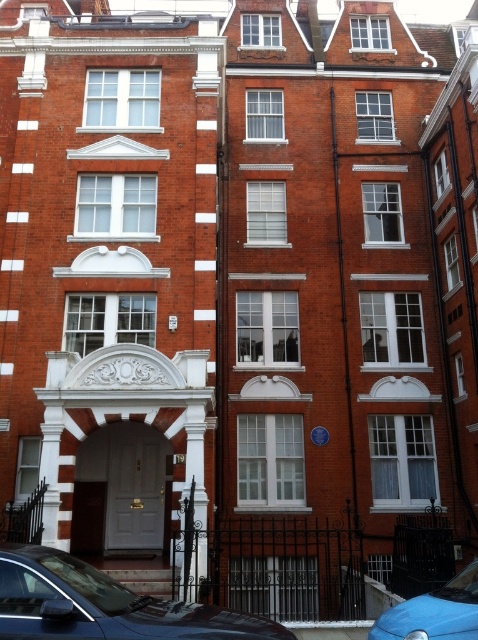
Does shiny black car at lower left appear over blue matte car at lower right?

Correct, shiny black car at lower left is located above blue matte car at lower right.

What do you see at coordinates (102, 605) in the screenshot? I see `shiny black car at lower left` at bounding box center [102, 605].

This screenshot has height=640, width=478. In order to click on shiny black car at lower left in this screenshot , I will do `click(102, 605)`.